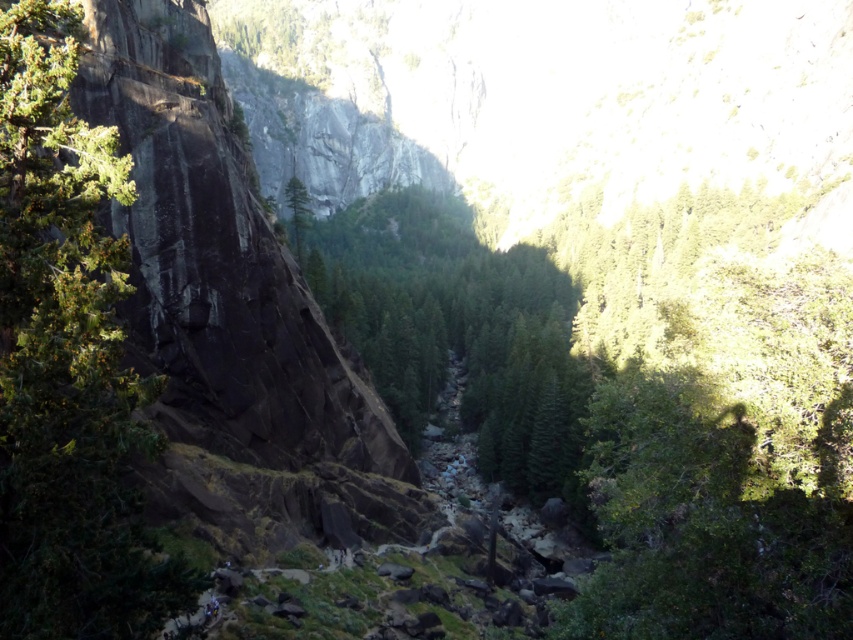
Question: Does green textured rock at left have a lesser width compared to green textured tree at center?

Choices:
 (A) no
 (B) yes

Answer: (B)

Question: Does green textured rock at left have a smaller size compared to green textured tree at center?

Choices:
 (A) no
 (B) yes

Answer: (B)

Question: Is green textured rock at left bigger than green textured tree at center?

Choices:
 (A) yes
 (B) no

Answer: (B)